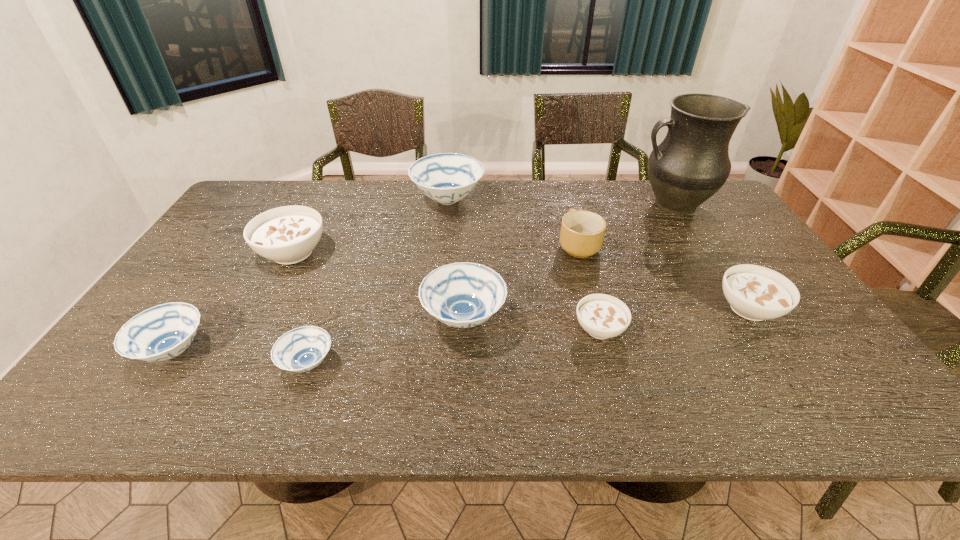
This screenshot has height=540, width=960. Identify the location of the second smallest blue soup bowl. (163, 332).

This screenshot has height=540, width=960. Identify the location of the second white soup bowl from left to right. [602, 316].

Where is `the sixth soup bowl from left to right`? This screenshot has width=960, height=540. the sixth soup bowl from left to right is located at coordinates (602, 316).

This screenshot has width=960, height=540. In order to click on the smallest blue soup bowl in this screenshot , I will do `click(301, 349)`.

This screenshot has width=960, height=540. Identify the location of blank space located 0.310m on the handle side of the tallest object. (543, 205).

Identify the location of free region located 0.360m on the handle side of the tallest object. (528, 205).

This screenshot has width=960, height=540. In order to click on vacant space situated on the handle side of the tallest object in this screenshot , I will do 549,205.

Find the location of a particular element. This screenshot has width=960, height=540. vacant space located on the right of the biggest blue soup bowl is located at coordinates (563, 199).

Find the location of a particular element. vacant region located 0.080m on the front of the sixth nearest soup bowl is located at coordinates point(270,296).

Where is `vacant position located on the side with the handle of the tan mug`? vacant position located on the side with the handle of the tan mug is located at coordinates (569, 215).